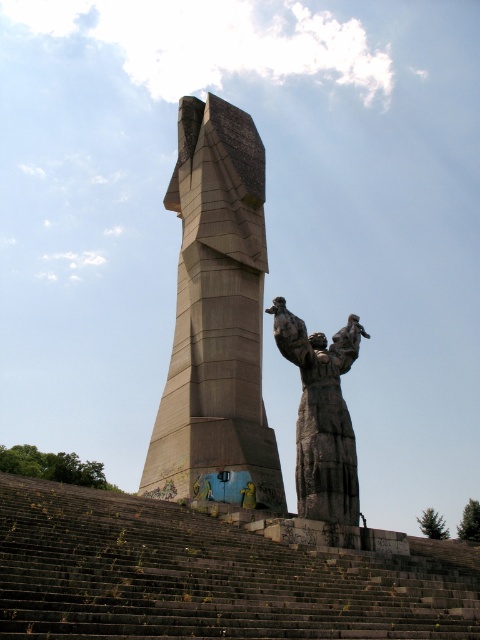
Question: Is gray stone statue at center smaller than rough stone statue at center?

Choices:
 (A) no
 (B) yes

Answer: (A)

Question: Which object appears farthest from the camera in this image?

Choices:
 (A) rough stone statue at center
 (B) gray stone statue at center

Answer: (B)

Question: Which point is farther from the camera taking this photo?

Choices:
 (A) tap(225, 397)
 (B) tap(348, 364)

Answer: (A)

Question: Can you confirm if gray stone statue at center is positioned to the left of rough stone statue at center?

Choices:
 (A) no
 (B) yes

Answer: (B)

Question: Is dark gray stone stairs at center above rough stone statue at center?

Choices:
 (A) no
 (B) yes

Answer: (A)

Question: Which of the following is the farthest from the observer?

Choices:
 (A) (475, 586)
 (B) (340, 392)

Answer: (B)